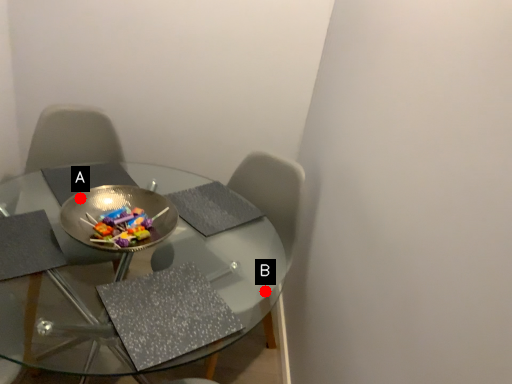
Question: Two points are circled on the image, labeled by A and B beside each circle. Which point is farther to the camera?

Choices:
 (A) A is further
 (B) B is further

Answer: (B)